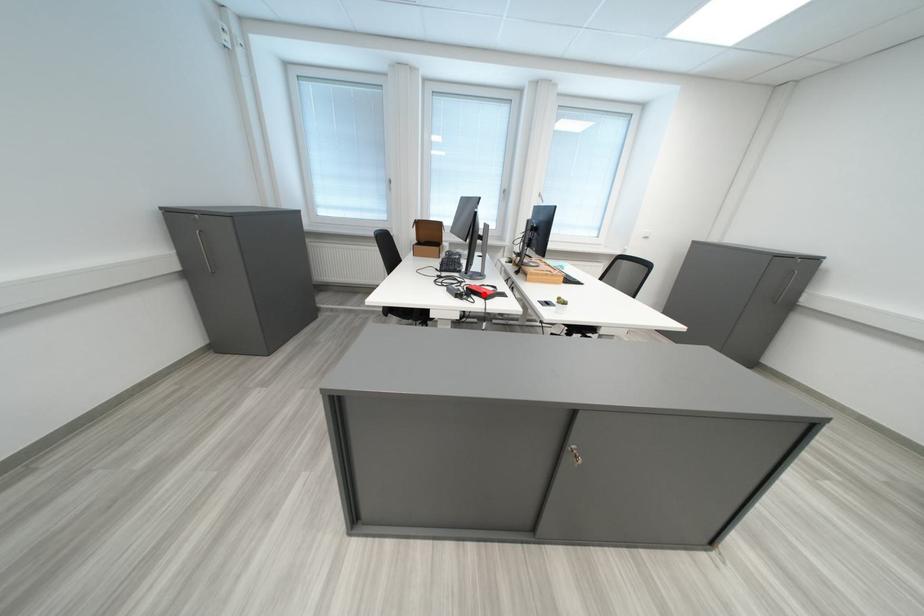
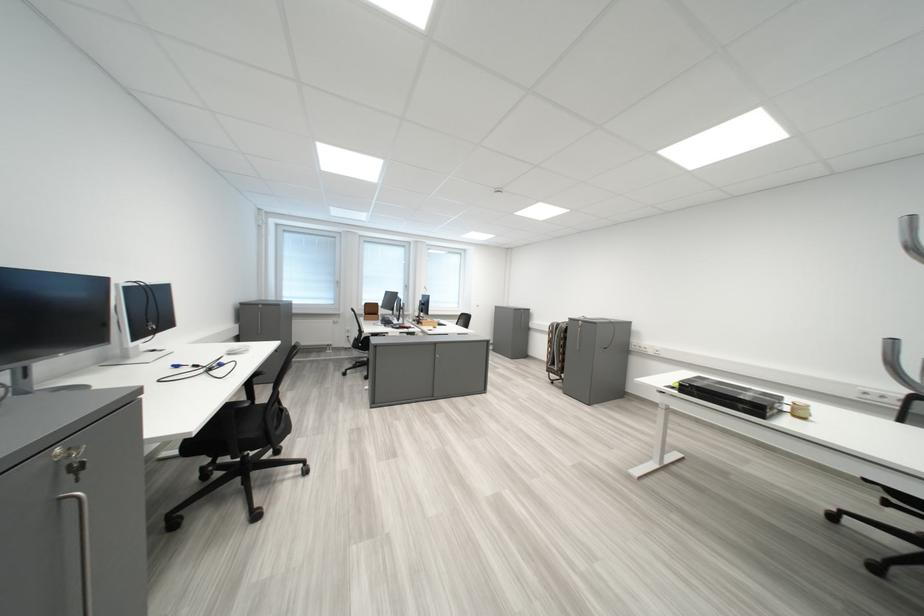
Question: I am providing you with two images of the same scene from different viewpoints. A red point is marked on the first image. Is the red point's position out of view in image 2?

Choices:
 (A) Yes
 (B) No

Answer: (A)